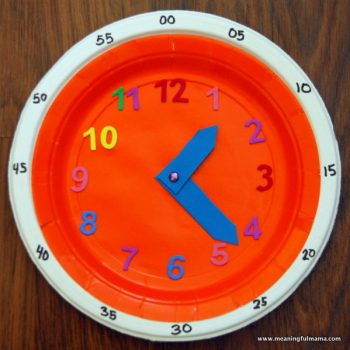
The height and width of the screenshot is (350, 350). I want to click on clock, so click(x=138, y=176).